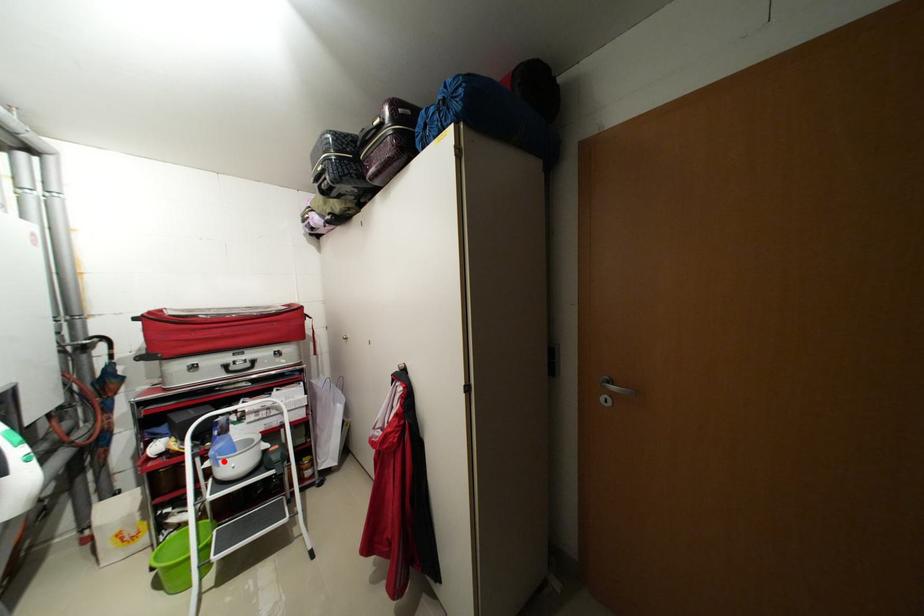
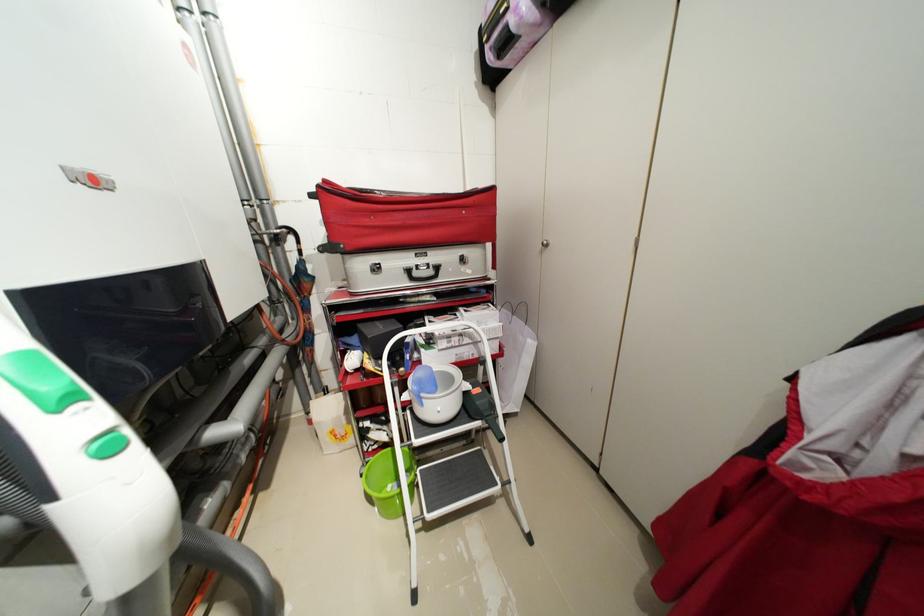
Find the pixel in the second image that matches the highlighted location in the first image.

(428, 400)